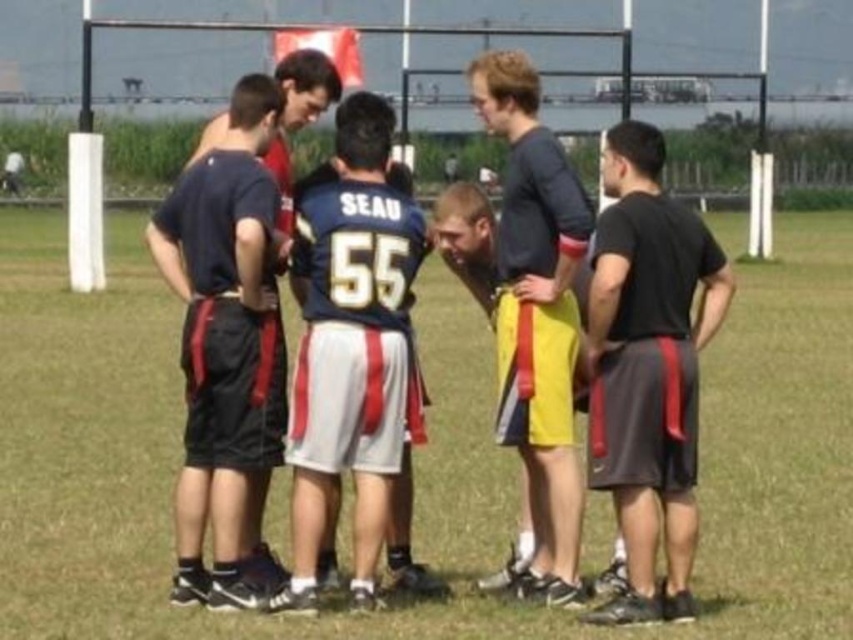
Question: Is blue jersey at center smaller than matte blue shirt at center?

Choices:
 (A) no
 (B) yes

Answer: (B)

Question: Among these points, which one is nearest to the camera?

Choices:
 (A) click(x=218, y=186)
 (B) click(x=311, y=90)

Answer: (A)

Question: Does black matte shorts at right lie behind matte black shirt at center?

Choices:
 (A) no
 (B) yes

Answer: (A)

Question: Is black matte shorts at right positioned before matte black shorts at left?

Choices:
 (A) yes
 (B) no

Answer: (A)

Question: Which point is farther to the camera?

Choices:
 (A) (553, 168)
 (B) (212, 344)

Answer: (A)

Question: Which point is farther to the camera?

Choices:
 (A) click(544, 394)
 (B) click(352, 276)
 (C) click(254, 442)
 (D) click(405, 358)

Answer: (A)